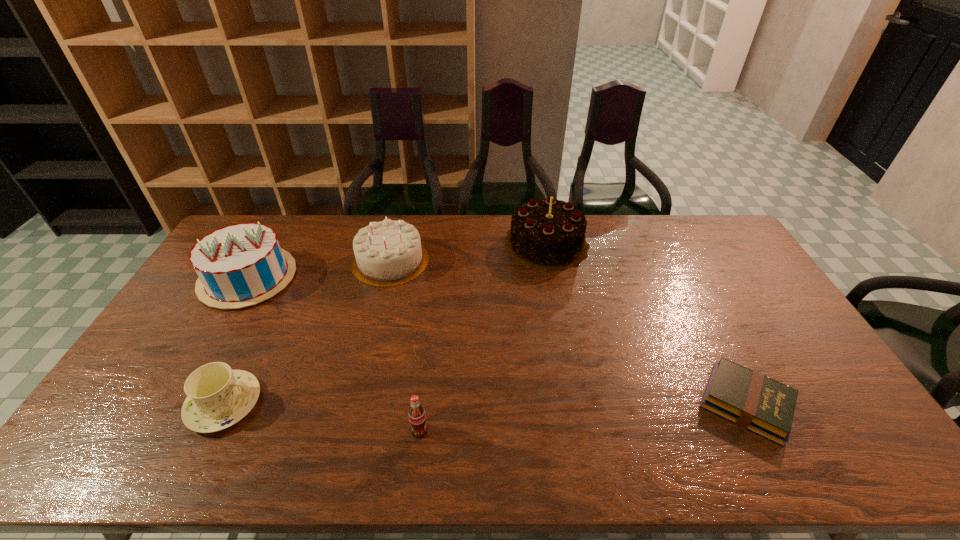
At what (x,y) coordinates should I click in order to perform the action: click on vacant region between the chinaware and the book. Please return your answer as a coordinate pair (x, y). Looking at the image, I should click on (485, 403).

Where is `free space between the fourth object from right to left and the shortest object`? The image size is (960, 540). free space between the fourth object from right to left and the shortest object is located at coordinates (568, 332).

You are a GUI agent. You are given a task and a screenshot of the screen. Output one action in this format:
    pyautogui.click(x=<x>, y=<y>)
    Task: Click on the empty space between the third object from right to left and the fifth object from left to right
    
    Given the screenshot: What is the action you would take?
    pyautogui.click(x=483, y=337)

I want to click on free space between the leftmost birthday cake and the rightmost object, so click(x=497, y=341).

Identify the location of the fourth closest object to the third object from left to right. The height and width of the screenshot is (540, 960). (417, 417).

Locate an element on the screen. Image resolution: width=960 pixels, height=540 pixels. object that is the fourth closest to the rightmost object is located at coordinates (218, 397).

Identify the location of birthday cake that is the second closest to the second birthday cake from right to left. (546, 234).

Choose which birthday cake is the third nearest neighbor to the fifth tallest object. Please provide its 2D coordinates. Your answer should be formatted as a tuple, i.e. [(x, y)], where the tuple contains the x and y coordinates of a point satisfying the conditions above.

[(546, 234)]

Find the location of a particular element. free region that satisfies the following two spatial constraints: 1. on the handle side of the chinaware; 2. on the back side of the rightmost object is located at coordinates (225, 403).

What are the coordinates of `free location that satisfies the following two spatial constraints: 1. on the front side of the rightmost object; 2. on the left side of the second birthday cake from left to right` in the screenshot? It's located at (357, 403).